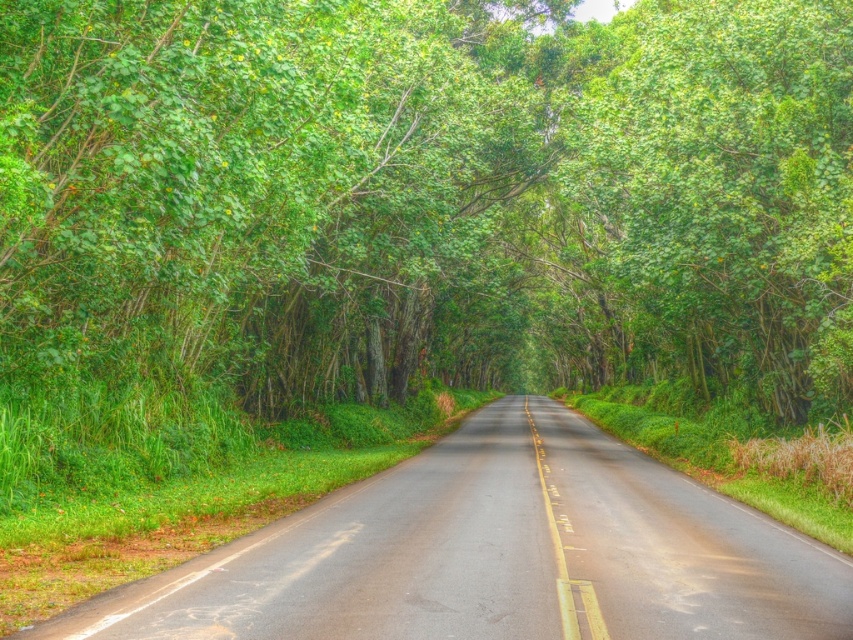
Measure the distance between point (171, 13) and camera.

Point (171, 13) and camera are 11.83 meters apart.

The image size is (853, 640). Describe the element at coordinates (434, 193) in the screenshot. I see `green leafy trees at center` at that location.

This screenshot has width=853, height=640. I want to click on green leafy trees at center, so click(434, 193).

Where is `green leafy trees at center`? This screenshot has height=640, width=853. green leafy trees at center is located at coordinates (434, 193).